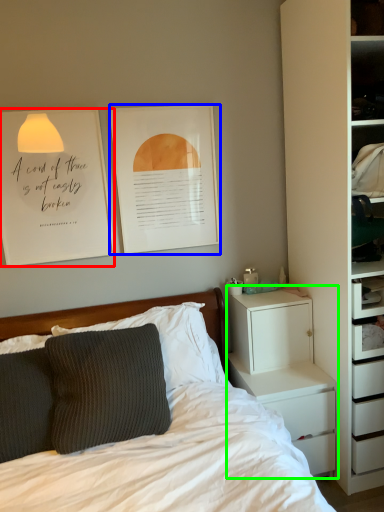
Question: Considering the real-world distances, which object is closest to bulletin board (highlighted by a red box)? picture frame (highlighted by a blue box) or chest of drawers (highlighted by a green box).

Choices:
 (A) picture frame
 (B) chest of drawers

Answer: (A)